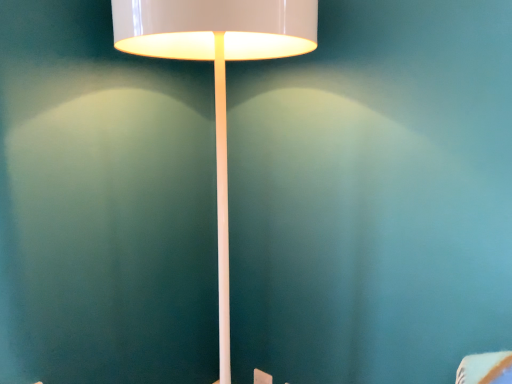
The image size is (512, 384). I want to click on white glossy floor lamp at center, so coord(217,74).

From the picture: Measure the distance between white glossy floor lamp at center and camera.

They are 32.95 inches apart.

What do you see at coordinates (217, 74) in the screenshot? The width and height of the screenshot is (512, 384). I see `white glossy floor lamp at center` at bounding box center [217, 74].

Find the location of a particular element. white glossy floor lamp at center is located at coordinates (217, 74).